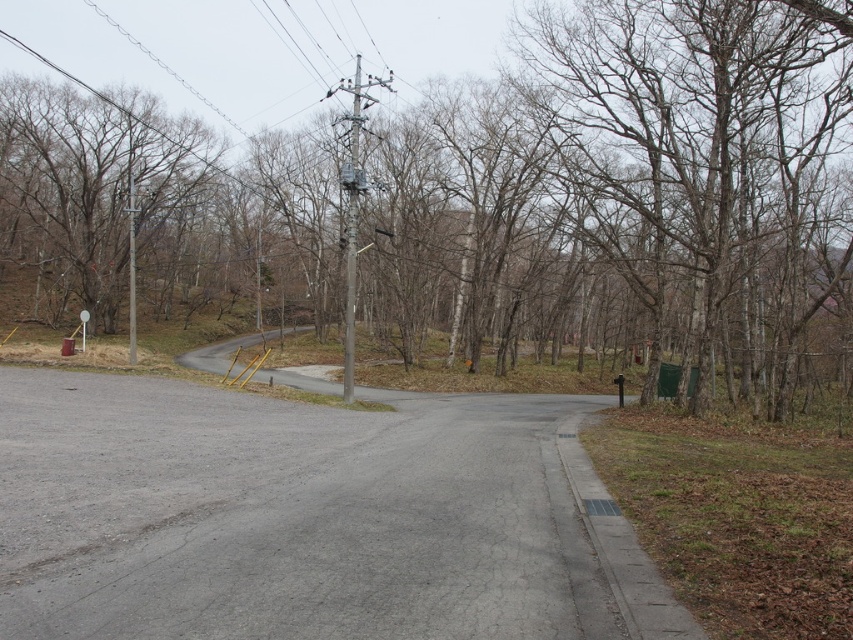
Is the position of gray concrete pole at center more distant than that of metallic gray pole at upper left?

That is False.

Find the location of `gray concrete pole at center`. gray concrete pole at center is located at coordinates (351, 221).

Is point (132, 252) in front of point (82, 339)?

Yes, it is.

Can you confirm if metallic gray pole at upper left is positioned to the left of white plastic sign at left?

In fact, metallic gray pole at upper left is to the right of white plastic sign at left.

Who is more distant from viewer, (132, 356) or (83, 308)?

The point (83, 308) is more distant.

Where is `metallic gray pole at upper left`? The image size is (853, 640). metallic gray pole at upper left is located at coordinates (131, 269).

Which is above, brown leafless tree at center or white plastic sign at left?

brown leafless tree at center

Between brown leafless tree at center and white plastic sign at left, which one has less height?

Standing shorter between the two is white plastic sign at left.

Locate an element on the screen. The image size is (853, 640). brown leafless tree at center is located at coordinates (492, 196).